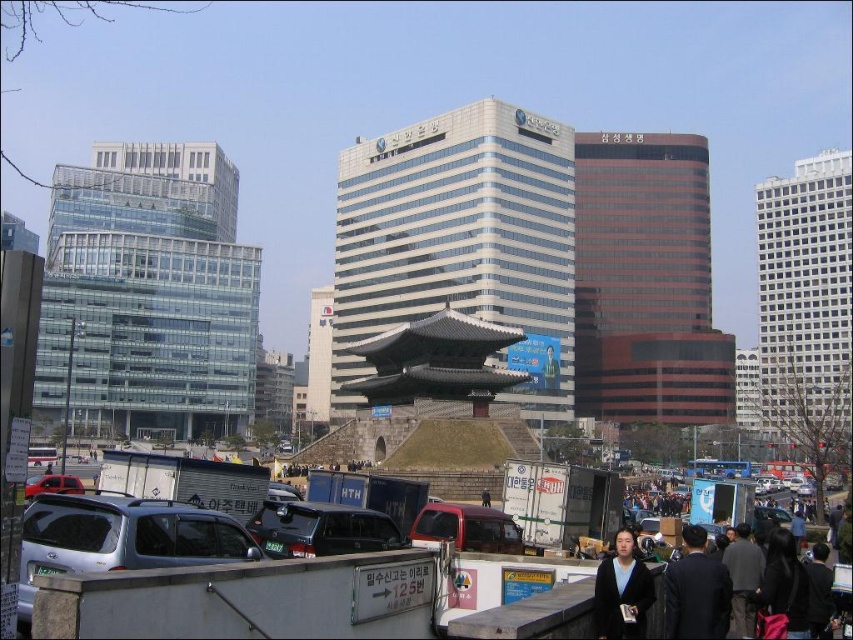
Does point (683, 600) come farther from viewer compared to point (509, 531)?

No, (683, 600) is closer to viewer.

The image size is (853, 640). What do you see at coordinates (695, 592) in the screenshot?
I see `dark blue suit at center` at bounding box center [695, 592].

Is point (683, 564) in front of point (521, 541)?

Yes, it is.

Find the location of `dark blue suit at center`. dark blue suit at center is located at coordinates (695, 592).

From the picture: Which is more to the left, shiny black suv at center or black wool coat at lower right?

From the viewer's perspective, shiny black suv at center appears more on the left side.

Who is more forward, (270, 508) or (689, 586)?

Positioned in front is point (689, 586).

This screenshot has width=853, height=640. Describe the element at coordinates (321, 529) in the screenshot. I see `shiny black suv at center` at that location.

Locate an element on the screen. Image resolution: width=853 pixels, height=640 pixels. shiny black suv at center is located at coordinates (321, 529).

Can you confirm if black wool coat at lower right is positioned to the right of matte red car at lower left?

Yes, black wool coat at lower right is to the right of matte red car at lower left.

Between black wool coat at lower right and matte red car at lower left, which one appears on the right side from the viewer's perspective?

black wool coat at lower right is more to the right.

This screenshot has width=853, height=640. What do you see at coordinates (700, 602) in the screenshot? I see `black wool coat at lower right` at bounding box center [700, 602].

The width and height of the screenshot is (853, 640). I want to click on black wool coat at lower right, so click(700, 602).